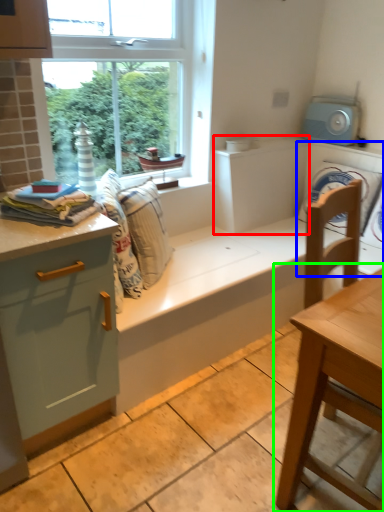
Question: Which object is the closest to the cabinetry (highlighted by a red box)? Choose among these: washing machine (highlighted by a blue box) or table (highlighted by a green box).

Choices:
 (A) washing machine
 (B) table

Answer: (A)